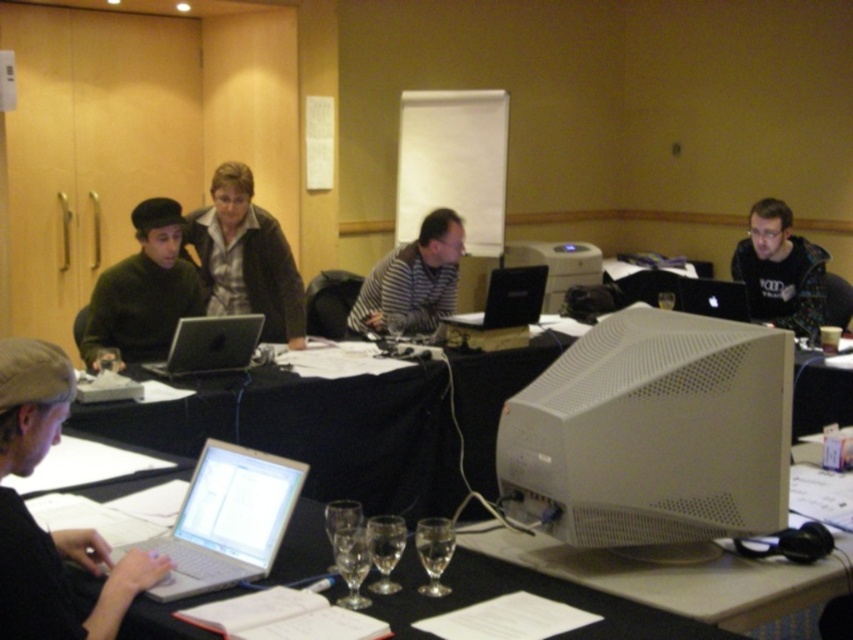
You are at a meeting and need to pour water into the largest glass available on the table. Which glass should you choose between the clear glass wine glass at lower center and the clear glass wine glass at center?

The clear glass wine glass at center is the larger one, so you should choose that one.

You are organizing a presentation and need to place both the white plastic printer at center and the black glossy laptop at right on a table that can only accommodate one large item. Which item should you prioritize placing first?

You should prioritize placing the white plastic printer at center first because it is bigger than the black glossy laptop at right, so it requires more space.